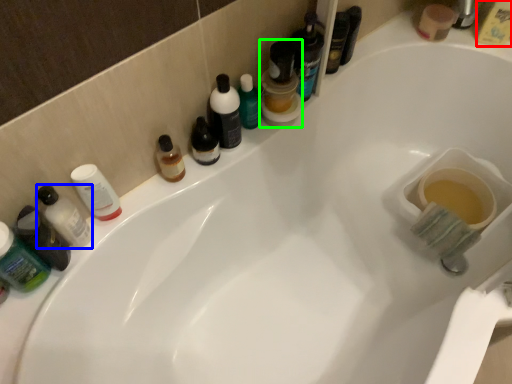
Question: Estimate the real-world distances between objects in this image. Which object is closer to mouthwash (highlighted by a red box), toiletry (highlighted by a blue box) or mouthwash (highlighted by a green box)?

Choices:
 (A) toiletry
 (B) mouthwash

Answer: (B)